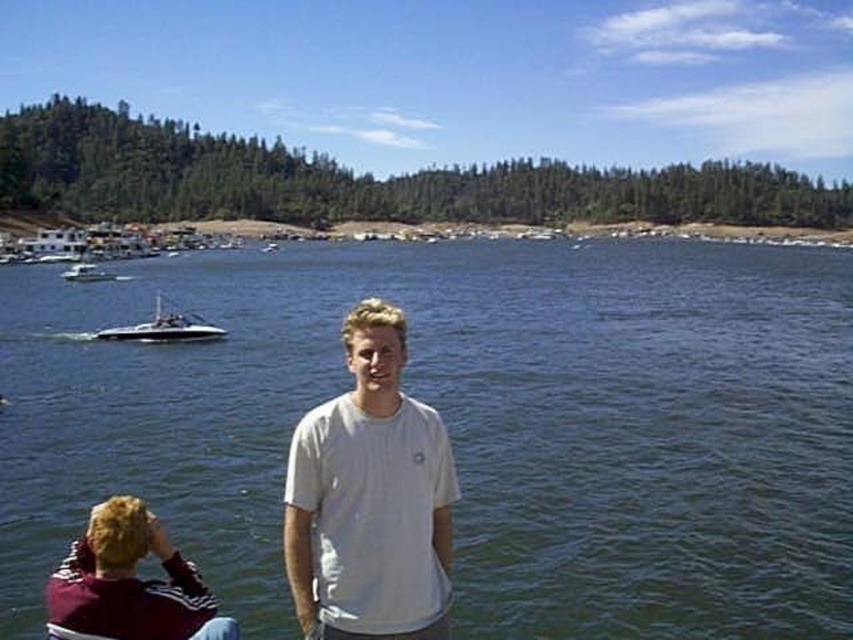
Does white cotton t-shirt at center appear over white glossy boat at center?

No, white cotton t-shirt at center is not above white glossy boat at center.

Based on the photo, can you confirm if white cotton t-shirt at center is taller than white glossy boat at center?

Yes.

Is point (426, 426) positioned after point (271, 250)?

No, it is in front of (271, 250).

The height and width of the screenshot is (640, 853). I want to click on white cotton t-shirt at center, so click(369, 499).

Is maroon fabric shirt at lower left bigger than shiny white speedboat at center?

Actually, maroon fabric shirt at lower left might be smaller than shiny white speedboat at center.

Who is more forward, (65, 612) or (190, 321)?

Point (65, 612) is more forward.

Is point (49, 604) positioned behind point (164, 314)?

No, it is in front of (164, 314).

I want to click on maroon fabric shirt at lower left, so click(x=128, y=582).

Between clear water at center and white glossy boat at center, which one appears on the left side from the viewer's perspective?

Positioned to the left is white glossy boat at center.

Based on the photo, does clear water at center appear over white glossy boat at center?

No, clear water at center is not above white glossy boat at center.

Locate an element on the screen. This screenshot has height=640, width=853. clear water at center is located at coordinates (468, 426).